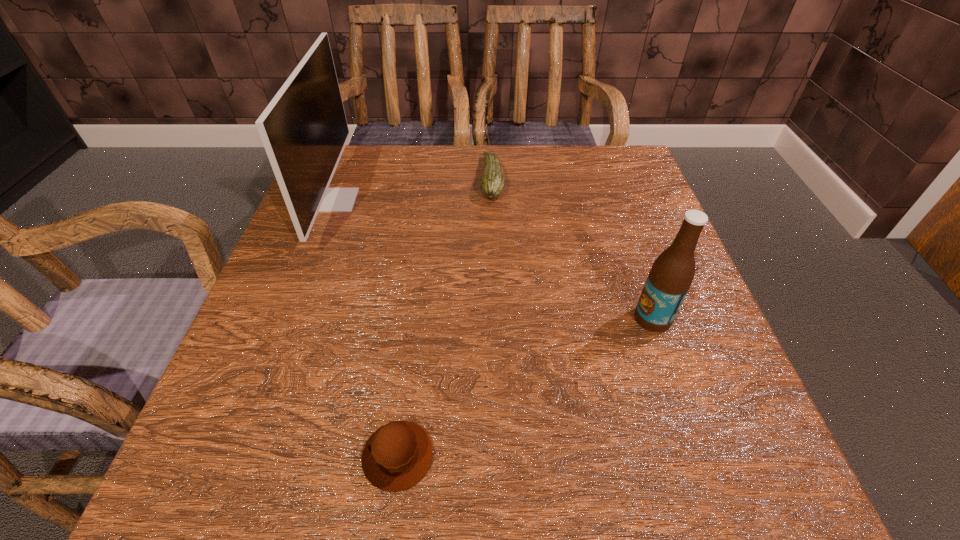
I want to click on free spot that satisfies the following two spatial constraints: 1. on the front-facing side of the rightmost object; 2. on the left side of the monitor, so click(289, 319).

I want to click on blank space that satisfies the following two spatial constraints: 1. on the front-facing side of the muffin; 2. on the left side of the monitor, so click(x=236, y=456).

Locate an element on the screen. blank area in the image that satisfies the following two spatial constraints: 1. at the stem end of the second nearest object; 2. on the right side of the second object from right to left is located at coordinates (496, 319).

Locate an element on the screen. The image size is (960, 540). vacant area that satisfies the following two spatial constraints: 1. on the back side of the beer bottle; 2. at the stem end of the second object from right to left is located at coordinates (605, 179).

Locate an element on the screen. The height and width of the screenshot is (540, 960). free location that satisfies the following two spatial constraints: 1. at the stem end of the second nearest object; 2. on the left side of the third object from left to right is located at coordinates (496, 319).